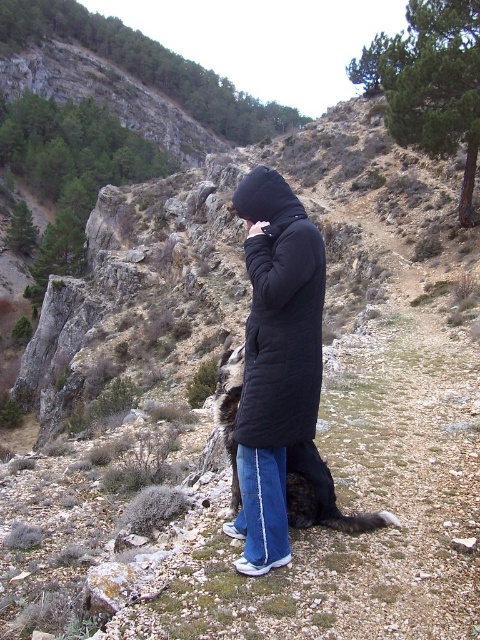
You are a photographer trying to capture both the black puffy coat at center and the dark brown fur at center in a single frame. Since your camera has a fixed width, which object should you position closer to the camera to ensure both fit in the frame?

Since the black puffy coat at center is narrower than the dark brown fur at center, you should position the black puffy coat at center closer to the camera. This way, its apparent width will increase, making it easier to fit both objects within the frame.

You are a hiker who just arrived at the mountain trail. You see a black puffy coat at center and a dark brown fur at center. Which object is closer to your current position?

The black puffy coat at center is located above the dark brown fur at center, so the dark brown fur at center is closer to your current position.

You are a photographer positioned at the camera location. You want to capture a closeup shot of the black puffy coat at center. Given that your camera has a minimum focusing distance of 2 meters, will you be able to take the photo without moving closer?

The black puffy coat at center is 8.44 meters away from the camera. Since your camera can focus as close as 2 meters, you can take the closeup shot without moving closer because the distance is within the focusing range.